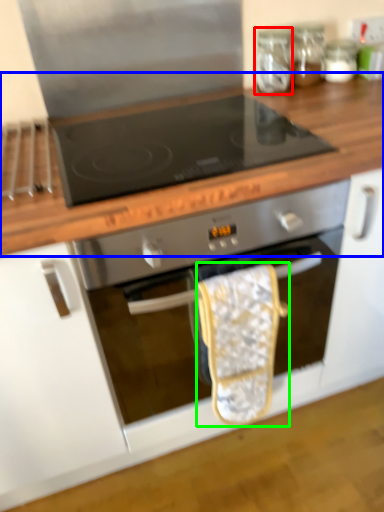
Question: Estimate the real-world distances between objects in this image. Which object is farther from glass jar (highlighted by a red box), countertop (highlighted by a blue box) or material (highlighted by a green box)?

Choices:
 (A) countertop
 (B) material

Answer: (B)